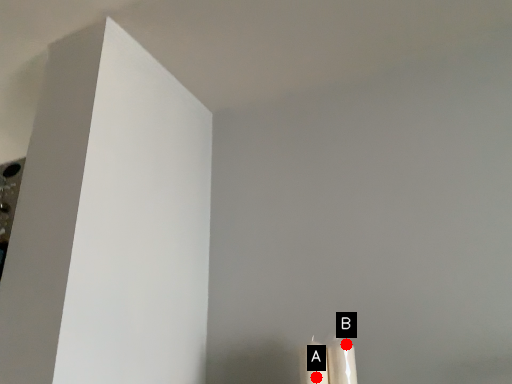
Question: Two points are circled on the image, labeled by A and B beside each circle. Which point is closer to the camera?

Choices:
 (A) A is closer
 (B) B is closer

Answer: (A)